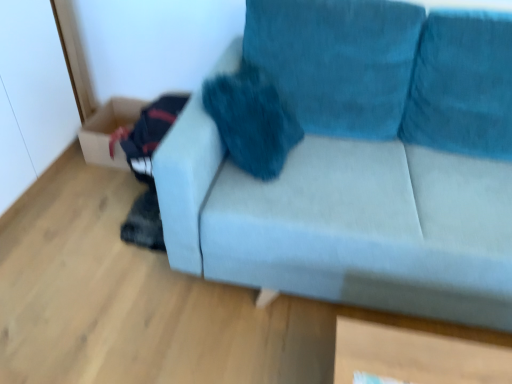
Question: Is cardboard box at lower left shorter than velvet teal couch at center?

Choices:
 (A) no
 (B) yes

Answer: (B)

Question: Could you tell me if cardboard box at lower left is turned towards velvet teal couch at center?

Choices:
 (A) no
 (B) yes

Answer: (A)

Question: Is cardboard box at lower left further to the viewer compared to velvet teal couch at center?

Choices:
 (A) yes
 (B) no

Answer: (A)

Question: Is cardboard box at lower left thinner than velvet teal couch at center?

Choices:
 (A) yes
 (B) no

Answer: (A)

Question: Is cardboard box at lower left next to velvet teal couch at center and touching it?

Choices:
 (A) yes
 (B) no

Answer: (B)

Question: Is the depth of cardboard box at lower left less than that of velvet teal couch at center?

Choices:
 (A) no
 (B) yes

Answer: (A)

Question: Is velvet teal couch at center in front of cardboard box at lower left?

Choices:
 (A) yes
 (B) no

Answer: (A)

Question: Could you tell me if velvet teal couch at center is facing cardboard box at lower left?

Choices:
 (A) no
 (B) yes

Answer: (A)

Question: Is velvet teal couch at center wider than cardboard box at lower left?

Choices:
 (A) no
 (B) yes

Answer: (B)

Question: From a real-world perspective, does velvet teal couch at center sit lower than cardboard box at lower left?

Choices:
 (A) no
 (B) yes

Answer: (A)

Question: Is velvet teal couch at center positioned far away from cardboard box at lower left?

Choices:
 (A) yes
 (B) no

Answer: (A)

Question: From the image's perspective, is velvet teal couch at center above cardboard box at lower left?

Choices:
 (A) no
 (B) yes

Answer: (A)

Question: Based on their sizes in the image, would you say cardboard box at lower left is bigger or smaller than velvet teal couch at center?

Choices:
 (A) small
 (B) big

Answer: (A)